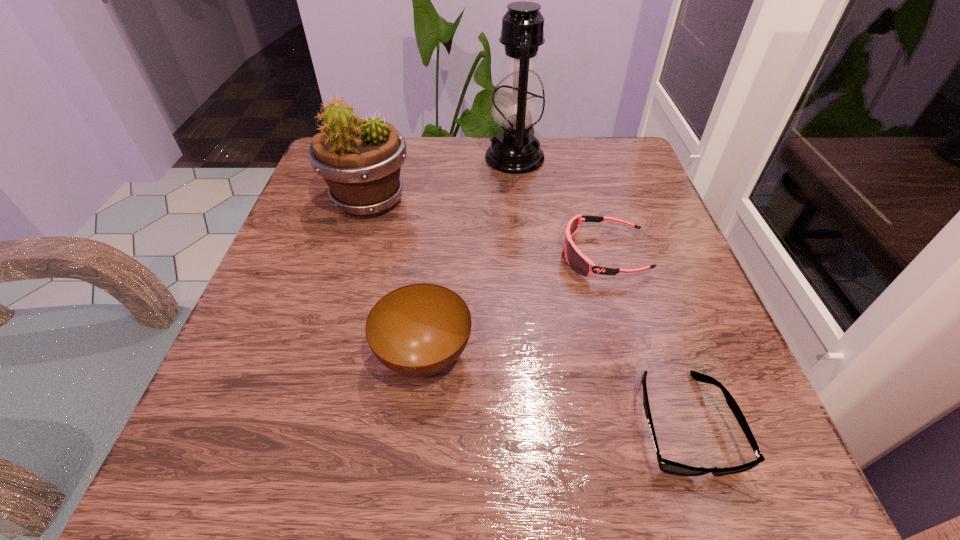
This screenshot has height=540, width=960. I want to click on free spot between the bowl and the oil lamp, so click(469, 257).

Image resolution: width=960 pixels, height=540 pixels. In order to click on free space between the tallest object and the bowl in this screenshot , I will do `click(469, 257)`.

This screenshot has width=960, height=540. In order to click on free space that is in between the bowl and the oil lamp in this screenshot , I will do `click(469, 257)`.

Find the location of a particular element. vacant space that's between the goggles and the sunglasses is located at coordinates (644, 339).

You are a GUI agent. You are given a task and a screenshot of the screen. Output one action in this format:
    pyautogui.click(x=<x>, y=<y>)
    Task: Click on the empty space that is in between the fourth tallest object and the third tallest object
    This screenshot has height=540, width=960.
    Given the screenshot: What is the action you would take?
    pyautogui.click(x=514, y=305)

Identify which object is the fourth nearest to the second shortest object. Please provide its 2D coordinates. Your answer should be formatted as a tuple, i.e. [(x, y)], where the tuple contains the x and y coordinates of a point satisfying the conditions above.

[(360, 160)]

At what (x,y) coordinates should I click in order to perform the action: click on object that is the fourth closest to the tallest object. Please return your answer as a coordinate pair (x, y). Looking at the image, I should click on (667, 466).